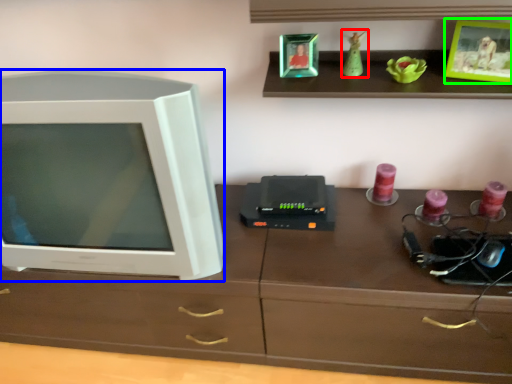
Question: Based on their relative distances, which object is nearer to toy (highlighted by a red box)? Choose from television (highlighted by a blue box) and picture frame (highlighted by a green box).

Choices:
 (A) television
 (B) picture frame

Answer: (B)